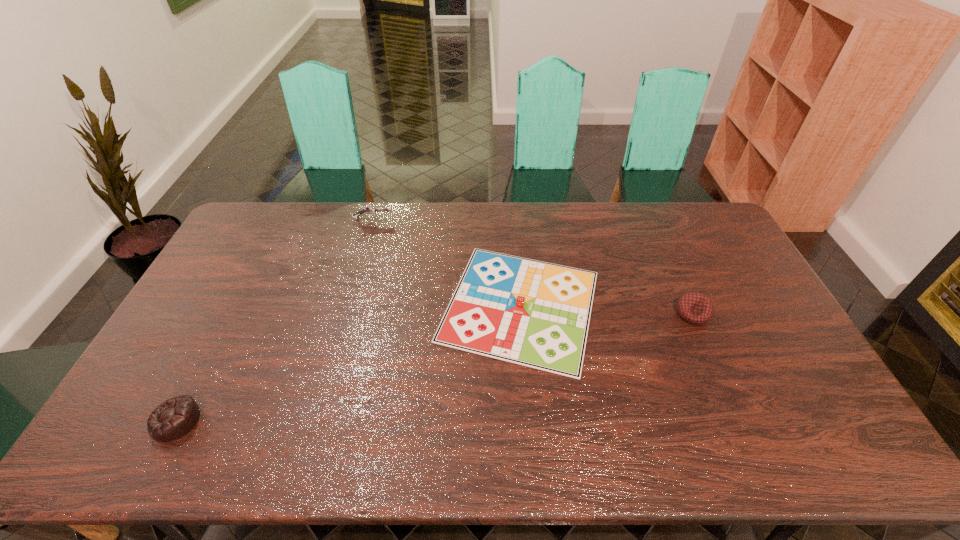
The height and width of the screenshot is (540, 960). Find the location of `free space located on the back of the nearest object`. free space located on the back of the nearest object is located at coordinates (238, 301).

The height and width of the screenshot is (540, 960). I want to click on free space located 0.210m on the back of the gameboard, so click(x=513, y=214).

The image size is (960, 540). I want to click on object located in the far edge section of the desktop, so [x=369, y=209].

At what (x,y) coordinates should I click in order to perform the action: click on object that is at the near edge. Please return your answer as a coordinate pair (x, y). The height and width of the screenshot is (540, 960). Looking at the image, I should click on (174, 418).

Find the location of a particular element. Image resolution: width=960 pixels, height=540 pixels. object that is at the left edge is located at coordinates (174, 418).

This screenshot has width=960, height=540. Find the location of `object that is at the near left corner`. object that is at the near left corner is located at coordinates coord(174,418).

What are the coordinates of `free space at the far edge of the desktop` in the screenshot? It's located at (649, 222).

The image size is (960, 540). I want to click on free space at the near edge of the desktop, so click(208, 429).

In the image, there is a desktop. What are the coordinates of `vacant space at the left edge` in the screenshot? It's located at (211, 359).

The height and width of the screenshot is (540, 960). In the image, there is a desktop. What are the coordinates of `vacant space at the right edge` in the screenshot? It's located at (765, 366).